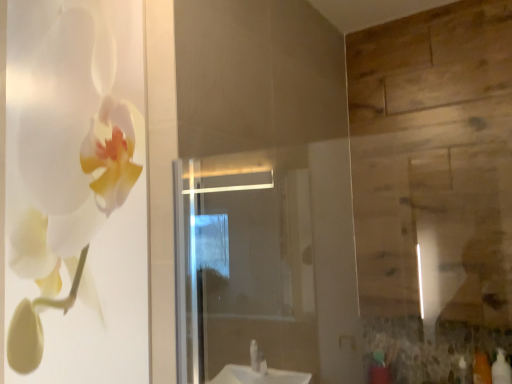
Describe the element at coordinates (75, 187) in the screenshot. This screenshot has width=512, height=384. I see `white glossy orchid at left` at that location.

You are a GUI agent. You are given a task and a screenshot of the screen. Output one action in this format:
    pyautogui.click(x=<x>, y=<y>)
    Task: Click on the white glossy orchid at left
    
    Given the screenshot: What is the action you would take?
    pyautogui.click(x=75, y=187)

At what (x,y) coordinates should I click in order to perform the action: click on white glossy orchid at left. Please return your answer as a coordinate pair (x, y). Looking at the image, I should click on (75, 187).